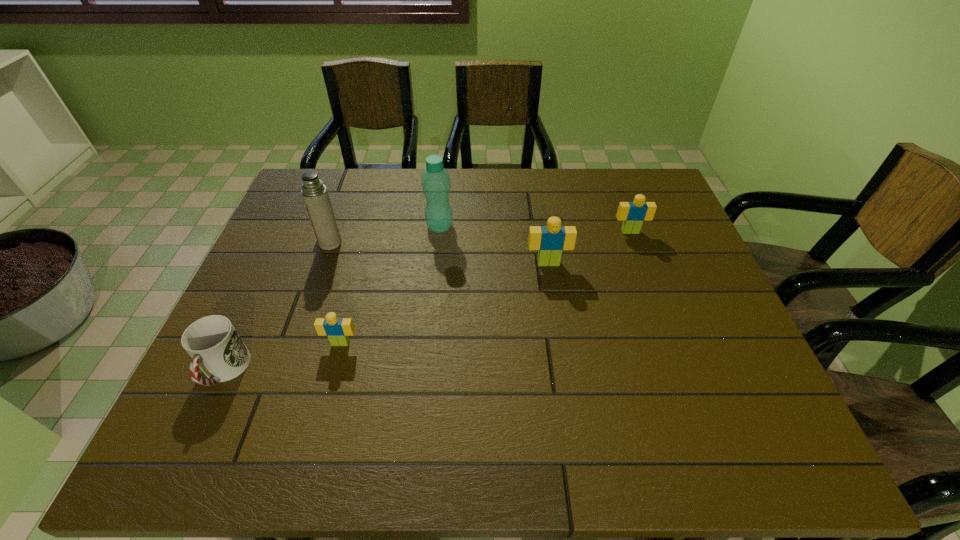
Locate an element on the screen. The height and width of the screenshot is (540, 960). vacant space located 0.250m on the face of the second Lego from left to right is located at coordinates click(x=561, y=345).

Locate an element on the screen. vacant space located 0.200m on the face of the farthest Lego is located at coordinates (650, 285).

What are the coordinates of `vacant space located 0.230m on the right of the fourth object from left to right` in the screenshot? It's located at (532, 226).

The height and width of the screenshot is (540, 960). I want to click on vacant space located on the right of the second object from left to right, so click(x=409, y=242).

In order to click on object at the near edge in this screenshot , I will do `click(214, 345)`.

You are a GUI agent. You are given a task and a screenshot of the screen. Output one action in this format:
    pyautogui.click(x=<x>, y=<y>)
    Task: Click on the thermos bottle that is positioned at the left edge
    Image resolution: width=960 pixels, height=540 pixels.
    Given the screenshot: What is the action you would take?
    pyautogui.click(x=314, y=193)

Identify the location of cup located in the left edge section of the desktop. (214, 345).

The width and height of the screenshot is (960, 540). What are the coordinates of `object located at the right edge` in the screenshot? It's located at (632, 214).

Where is `object positioned at the near left corner`? This screenshot has height=540, width=960. object positioned at the near left corner is located at coordinates (214, 345).

In the image, there is a desktop. At what (x,y) coordinates should I click in order to perform the action: click on vacant space at the far edge. Please return your answer as a coordinate pair (x, y). The image size is (960, 540). Looking at the image, I should click on (401, 213).